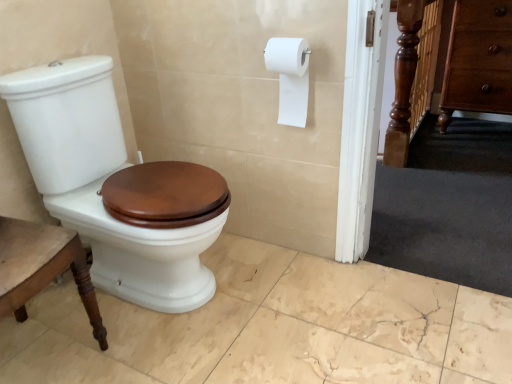
Question: From the image's perspective, is white glossy toilet at left located above white matte toilet paper at upper right?

Choices:
 (A) yes
 (B) no

Answer: (B)

Question: Considering the relative sizes of white glossy toilet at left and white matte toilet paper at upper right in the image provided, is white glossy toilet at left bigger than white matte toilet paper at upper right?

Choices:
 (A) no
 (B) yes

Answer: (B)

Question: Can you confirm if white glossy toilet at left is positioned to the right of white matte toilet paper at upper right?

Choices:
 (A) yes
 (B) no

Answer: (B)

Question: Is white glossy toilet at left positioned far away from white matte toilet paper at upper right?

Choices:
 (A) no
 (B) yes

Answer: (A)

Question: Could white matte toilet paper at upper right be considered to be inside white glossy toilet at left?

Choices:
 (A) yes
 (B) no

Answer: (B)

Question: From a real-world perspective, is white glossy toilet at left on white matte toilet paper at upper right?

Choices:
 (A) no
 (B) yes

Answer: (A)

Question: Is brown wood drawer at right shorter than white matte toilet paper at upper right?

Choices:
 (A) no
 (B) yes

Answer: (A)

Question: Is brown wood drawer at right facing away from white matte toilet paper at upper right?

Choices:
 (A) yes
 (B) no

Answer: (B)

Question: Are brown wood drawer at right and white matte toilet paper at upper right making contact?

Choices:
 (A) no
 (B) yes

Answer: (A)

Question: Would you say brown wood drawer at right is outside white matte toilet paper at upper right?

Choices:
 (A) yes
 (B) no

Answer: (A)

Question: Is brown wood drawer at right taller than white matte toilet paper at upper right?

Choices:
 (A) yes
 (B) no

Answer: (A)

Question: Is brown wood drawer at right positioned in front of white matte toilet paper at upper right?

Choices:
 (A) yes
 (B) no

Answer: (B)

Question: Is white glossy toilet at left looking in the opposite direction of brown wood drawer at right?

Choices:
 (A) yes
 (B) no

Answer: (B)